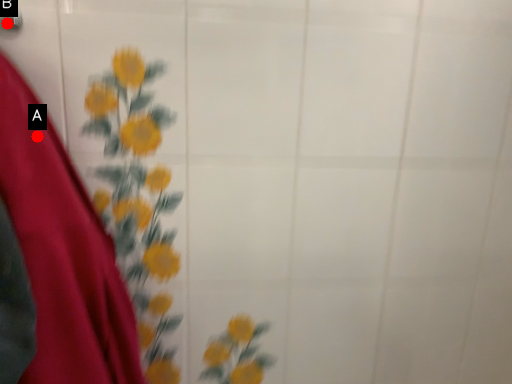
Question: Two points are circled on the image, labeled by A and B beside each circle. Which point is further to the camera?

Choices:
 (A) A is further
 (B) B is further

Answer: (B)